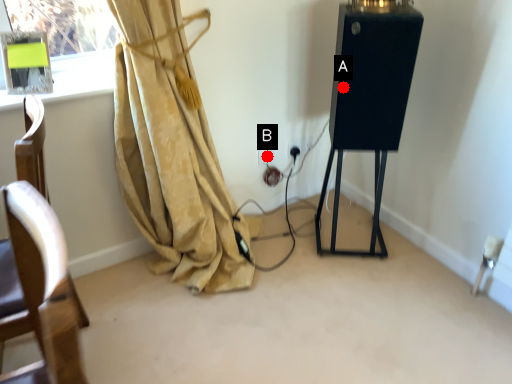
Question: Two points are circled on the image, labeled by A and B beside each circle. Which point is closer to the camera taking this photo?

Choices:
 (A) A is closer
 (B) B is closer

Answer: (A)